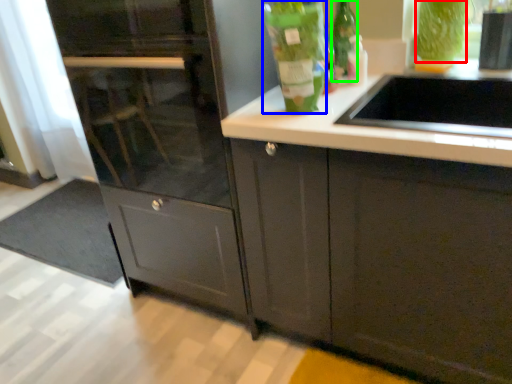
Question: Which object is the farthest from drink (highlighted by a red box)? Choose among these: bottle (highlighted by a blue box) or glass bottle (highlighted by a green box).

Choices:
 (A) bottle
 (B) glass bottle

Answer: (A)